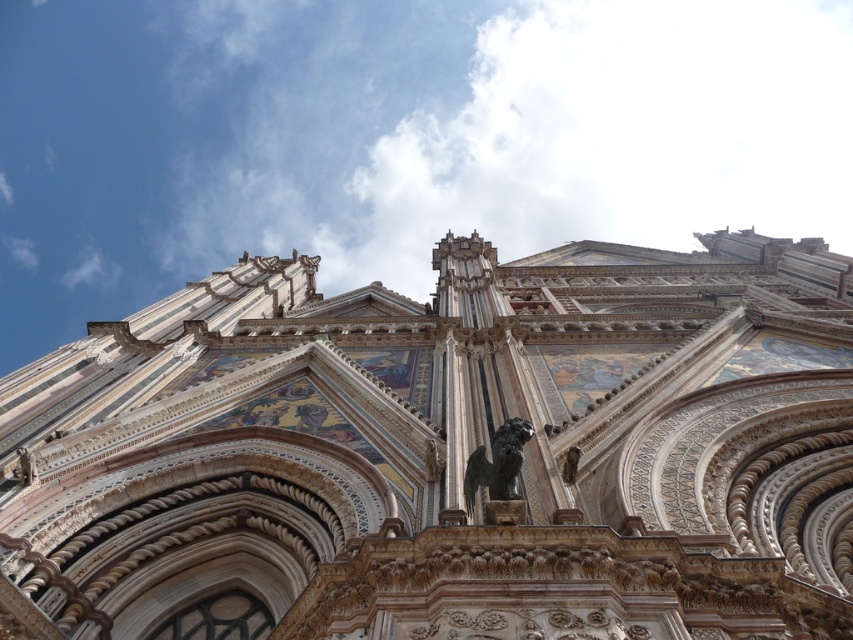
Does white marble church at center come in front of bronze statue at center?

Yes, it is in front of bronze statue at center.

Can you confirm if white marble church at center is wider than bronze statue at center?

Yes.

Does point (585, 432) come closer to viewer compared to point (486, 472)?

No.

This screenshot has height=640, width=853. Find the location of `white marble church at center`. white marble church at center is located at coordinates (445, 452).